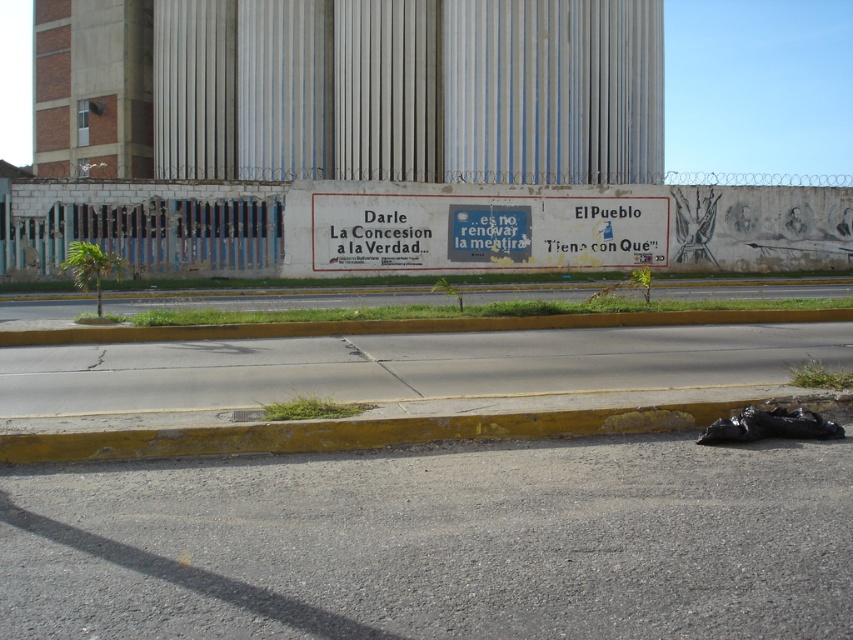
You are a delivery person trying to park your bike. You see the gray asphalt at lower center and the yellow concrete curb at lower center. Which surface should you place your bike on to ensure it is closer to the curb?

You should place your bike on the gray asphalt at lower center because it is closer to the yellow concrete curb at lower center than the curb itself.

You are a delivery driver approaching the yellow painted curb at lower center and the yellow concrete curb at lower center. Which one is closer to the street?

The yellow painted curb at lower center is closer to the street because it is in front of the yellow concrete curb at lower center.